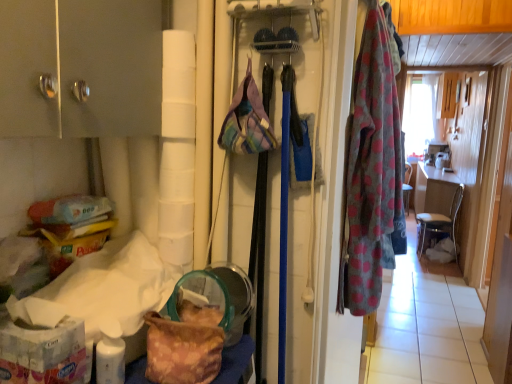
In order to face polka dot fabric robe at right, should I rotate leftwards or rightwards?

It's best to rotate right around 16.488 degrees.

What are the coordinates of `matte silver cabinet at upper left` in the screenshot? It's located at (80, 68).

Between polka dot fabric robe at right and matte silver cabinet at upper left, which one is positioned in front?

matte silver cabinet at upper left is in front.

Is polka dot fabric robe at right turned away from matte silver cabinet at upper left?

That's not correct — polka dot fabric robe at right is not looking away from matte silver cabinet at upper left.

Considering the sizes of objects polka dot fabric robe at right and matte silver cabinet at upper left in the image provided, who is bigger, polka dot fabric robe at right or matte silver cabinet at upper left?

With larger size is matte silver cabinet at upper left.

Does polka dot fabric robe at right have a lesser height compared to matte silver cabinet at upper left?

In fact, polka dot fabric robe at right may be taller than matte silver cabinet at upper left.

Is metallic silver chair at right shorter than white matte toilet paper at center?

No, metallic silver chair at right is not shorter than white matte toilet paper at center.

Does metallic silver chair at right touch white matte toilet paper at center?

No.

Is metallic silver chair at right smaller than white matte toilet paper at center?

No.

Is polka dot fabric robe at right facing towards camouflage fabric bag at lower left, the 1th handbag when ordered from bottom to top?

No, polka dot fabric robe at right is not turned towards camouflage fabric bag at lower left, the 1th handbag when ordered from bottom to top.

Can you confirm if polka dot fabric robe at right is wider than camouflage fabric bag at lower left, the 2th handbag in the right-to-left sequence?

Incorrect, the width of polka dot fabric robe at right does not surpass that of camouflage fabric bag at lower left, the 2th handbag in the right-to-left sequence.

Considering the sizes of objects polka dot fabric robe at right and camouflage fabric bag at lower left, positioned as the 2th handbag in top-to-bottom order, in the image provided, who is shorter, polka dot fabric robe at right or camouflage fabric bag at lower left, positioned as the 2th handbag in top-to-bottom order,?

With less height is camouflage fabric bag at lower left, positioned as the 2th handbag in top-to-bottom order.

Which object is further away from the camera, polka dot fabric robe at right or camouflage fabric bag at lower left, the first handbag in the left-to-right sequence?

polka dot fabric robe at right is behind.

Based on the photo, is camouflage fabric bag at lower left, the 2th handbag in the right-to-left sequence, positioned before white matte toilet paper at center?

Yes, camouflage fabric bag at lower left, the 2th handbag in the right-to-left sequence, is closer to the viewer.

Is camouflage fabric bag at lower left, positioned as the 2th handbag in top-to-bottom order, oriented away from white matte toilet paper at center?

No, white matte toilet paper at center is not at the back of camouflage fabric bag at lower left, positioned as the 2th handbag in top-to-bottom order.

Is camouflage fabric bag at lower left, the 1th handbag when ordered from bottom to top, taller or shorter than white matte toilet paper at center?

Clearly, camouflage fabric bag at lower left, the 1th handbag when ordered from bottom to top, is shorter compared to white matte toilet paper at center.

From the image's perspective, relative to white matte toilet paper at center, is camouflage fabric bag at lower left, the first handbag in the left-to-right sequence, above or below?

camouflage fabric bag at lower left, the first handbag in the left-to-right sequence, is below white matte toilet paper at center.

Is camouflage fabric bag at lower left, the 1th handbag when ordered from bottom to top, located outside metallic silver chair at right?

Yes, camouflage fabric bag at lower left, the 1th handbag when ordered from bottom to top, is located beyond the bounds of metallic silver chair at right.

From a real-world perspective, which object stands above the other?

camouflage fabric bag at lower left, positioned as the 2th handbag in top-to-bottom order, from a real-world perspective.

Consider the image. From the image's perspective, between camouflage fabric bag at lower left, the 2th handbag in the right-to-left sequence, and metallic silver chair at right, which one is located above?

metallic silver chair at right.

Measure the distance between matte silver cabinet at upper left and polka dot fabric robe at right.

matte silver cabinet at upper left is 33.11 inches from polka dot fabric robe at right.

From the image's perspective, between matte silver cabinet at upper left and polka dot fabric robe at right, who is located below?

From the image's view, polka dot fabric robe at right is below.

From a real-world perspective, which is physically above, matte silver cabinet at upper left or polka dot fabric robe at right?

matte silver cabinet at upper left.

Considering the sizes of matte silver cabinet at upper left and polka dot fabric robe at right in the image, is matte silver cabinet at upper left taller or shorter than polka dot fabric robe at right?

matte silver cabinet at upper left is shorter than polka dot fabric robe at right.

Looking at this image, is metallic silver chair at right taller or shorter than polka dot fabric robe at right?

Considering their sizes, metallic silver chair at right has less height than polka dot fabric robe at right.

From the image's perspective, is metallic silver chair at right below polka dot fabric robe at right?

Yes, from the image's perspective, metallic silver chair at right is below polka dot fabric robe at right.

Is metallic silver chair at right not close to polka dot fabric robe at right?

metallic silver chair at right is positioned a significant distance from polka dot fabric robe at right.

Is metallic silver chair at right facing away from polka dot fabric robe at right?

No, metallic silver chair at right is not facing the opposite direction of polka dot fabric robe at right.

At what (x,y) coordinates should I click in order to perform the action: click on clothing behind the matte silver cabinet at upper left. Please return your answer as a coordinate pair (x, y). Image resolution: width=512 pixels, height=384 pixels. Looking at the image, I should click on (372, 173).

Locate an element on the screen. The width and height of the screenshot is (512, 384). chair lying on the right of white matte toilet paper at center is located at coordinates (440, 218).

Looking at the image, which one is located closer to metallic silver chair at right, plaid fabric handbag at center, marked as the 2th handbag in a left-to-right arrangement, or matte silver cabinet at upper left?

The object closer to metallic silver chair at right is plaid fabric handbag at center, marked as the 2th handbag in a left-to-right arrangement.

From the image, which object appears to be nearer to matte silver cabinet at upper left, metallic silver chair at right or plaid fabric handbag at center, which is the second handbag in bottom-to-top order?

plaid fabric handbag at center, which is the second handbag in bottom-to-top order, is positioned closer to the anchor matte silver cabinet at upper left.

Considering their positions, is metallic silver chair at right positioned further to polka dot fabric robe at right than plaid fabric handbag at center, which is the second handbag in bottom-to-top order?

Among the two, metallic silver chair at right is located further to polka dot fabric robe at right.

Based on their spatial positions, is white matte toilet paper at center or metallic silver chair at right closer to plaid fabric handbag at center, the 1th handbag from the top?

white matte toilet paper at center is closer to plaid fabric handbag at center, the 1th handbag from the top.

Which object lies nearer to the anchor point polka dot fabric robe at right, metallic silver chair at right or matte silver cabinet at upper left?

Based on the image, matte silver cabinet at upper left appears to be nearer to polka dot fabric robe at right.

From the image, which object appears to be nearer to metallic silver chair at right, matte silver cabinet at upper left or camouflage fabric bag at lower left, positioned as the 2th handbag in top-to-bottom order?

camouflage fabric bag at lower left, positioned as the 2th handbag in top-to-bottom order, is positioned closer to the anchor metallic silver chair at right.

Estimate the real-world distances between objects in this image. Which object is further from white matte toilet paper at center, plaid fabric handbag at center, marked as the 2th handbag in a left-to-right arrangement, or matte silver cabinet at upper left?

matte silver cabinet at upper left is positioned further to the anchor white matte toilet paper at center.

Estimate the real-world distances between objects in this image. Which object is further from white matte toilet paper at center, metallic silver chair at right or polka dot fabric robe at right?

The object further to white matte toilet paper at center is metallic silver chair at right.

The image size is (512, 384). Identify the location of toilet paper located between matte silver cabinet at upper left and metallic silver chair at right in the depth direction. (177, 148).

Locate an element on the screen. toilet paper positioned between plaid fabric handbag at center, marked as the 2th handbag in a left-to-right arrangement, and metallic silver chair at right from near to far is located at coordinates (177, 148).

Identify the location of clothing between matte silver cabinet at upper left and metallic silver chair at right along the z-axis. This screenshot has height=384, width=512. (372, 173).

The image size is (512, 384). Find the location of `handbag between matte silver cabinet at upper left and camouflage fabric bag at lower left, the 2th handbag in the right-to-left sequence, in the vertical direction`. handbag between matte silver cabinet at upper left and camouflage fabric bag at lower left, the 2th handbag in the right-to-left sequence, in the vertical direction is located at coordinates click(247, 121).